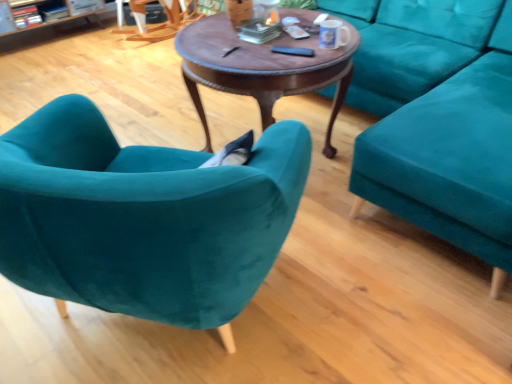
Question: Is wooden rocking chair at upper left completely or partially inside white glossy mug at upper center?

Choices:
 (A) yes
 (B) no

Answer: (B)

Question: Is the position of white glossy mug at upper center less distant than that of wooden rocking chair at upper left?

Choices:
 (A) yes
 (B) no

Answer: (A)

Question: Considering the relative sizes of white glossy mug at upper center and wooden rocking chair at upper left in the image provided, is white glossy mug at upper center taller than wooden rocking chair at upper left?

Choices:
 (A) yes
 (B) no

Answer: (B)

Question: Can you confirm if white glossy mug at upper center is shorter than wooden rocking chair at upper left?

Choices:
 (A) yes
 (B) no

Answer: (A)

Question: Is white glossy mug at upper center aimed at wooden rocking chair at upper left?

Choices:
 (A) no
 (B) yes

Answer: (A)

Question: From the image's perspective, does white glossy mug at upper center appear higher than wooden rocking chair at upper left?

Choices:
 (A) yes
 (B) no

Answer: (B)

Question: Considering the relative sizes of black matte remote control at center, arranged as the second remote control when viewed from the top, and white glossy mug at upper center in the image provided, is black matte remote control at center, arranged as the second remote control when viewed from the top, taller than white glossy mug at upper center?

Choices:
 (A) yes
 (B) no

Answer: (B)

Question: Considering the relative positions of black matte remote control at center, arranged as the first remote control when ordered from the bottom, and white glossy mug at upper center in the image provided, is black matte remote control at center, arranged as the first remote control when ordered from the bottom, to the right of white glossy mug at upper center from the viewer's perspective?

Choices:
 (A) no
 (B) yes

Answer: (A)

Question: Is white glossy mug at upper center at the back of black matte remote control at center, arranged as the second remote control when viewed from the top?

Choices:
 (A) no
 (B) yes

Answer: (A)

Question: Considering the relative sizes of black matte remote control at center, which is the first remote control in front-to-back order, and white glossy mug at upper center in the image provided, is black matte remote control at center, which is the first remote control in front-to-back order, bigger than white glossy mug at upper center?

Choices:
 (A) yes
 (B) no

Answer: (B)

Question: From a real-world perspective, is black matte remote control at center, which is the first remote control in front-to-back order, on top of white glossy mug at upper center?

Choices:
 (A) no
 (B) yes

Answer: (A)

Question: From the image's perspective, is black matte remote control at center, arranged as the second remote control when viewed from the top, above white glossy mug at upper center?

Choices:
 (A) no
 (B) yes

Answer: (A)

Question: From a real-world perspective, is teal velvet couch at right on black matte remote control at center, arranged as the second remote control when viewed from the top?

Choices:
 (A) yes
 (B) no

Answer: (B)